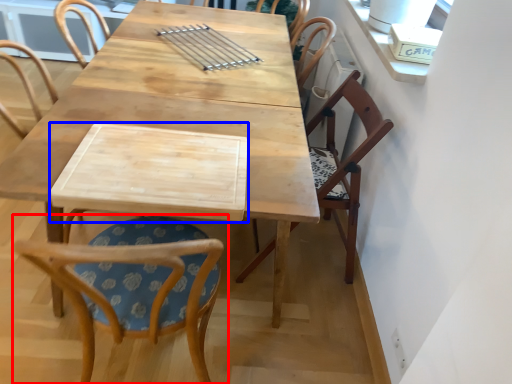
Question: Among these objects, which one is farthest to the camera, chair (highlighted by a red box) or plank (highlighted by a blue box)?

Choices:
 (A) chair
 (B) plank

Answer: (B)